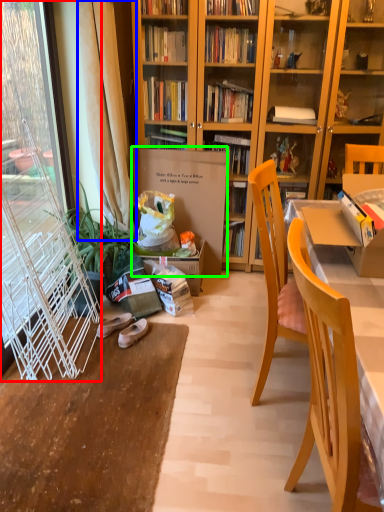
Question: Considering the real-world distances, which object is closest to screen door (highlighted by a red box)? curtain (highlighted by a blue box) or cardboard box (highlighted by a green box).

Choices:
 (A) curtain
 (B) cardboard box

Answer: (A)